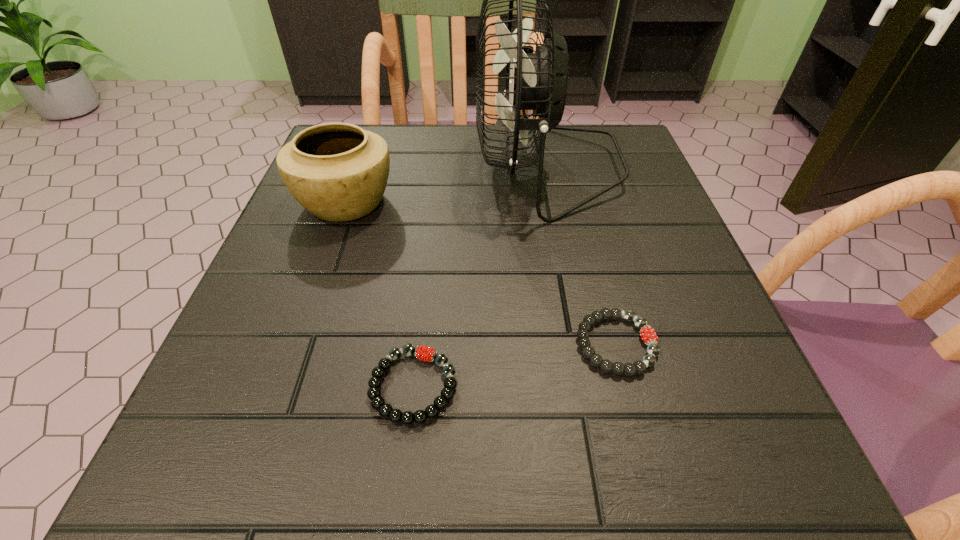
Locate an element on the screen. the tallest object is located at coordinates (539, 80).

Locate an element on the screen. The height and width of the screenshot is (540, 960). the second tallest object is located at coordinates (338, 172).

Image resolution: width=960 pixels, height=540 pixels. I want to click on the leftmost object, so click(x=338, y=172).

Identify the location of the left bracelet. This screenshot has width=960, height=540. (424, 353).

Locate an element on the screen. the right bracelet is located at coordinates (647, 333).

The width and height of the screenshot is (960, 540). What are the coordinates of `vacant space situated 0.220m in front of the fan, directing airflow` in the screenshot? It's located at (372, 167).

I want to click on vacant space located in front of the fan, directing airflow, so click(x=439, y=167).

At what (x,y) coordinates should I click in order to perform the action: click on vacant space situated 0.180m in front of the fan, directing airflow. Please return your answer as a coordinate pair (x, y). Looking at the image, I should click on (391, 167).

Locate an element on the screen. free space located 0.240m on the right of the leftmost object is located at coordinates (521, 202).

At what (x,y) coordinates should I click in order to perform the action: click on blank area located on the back of the left bracelet. Please return your answer as a coordinate pair (x, y). Looking at the image, I should click on (431, 239).